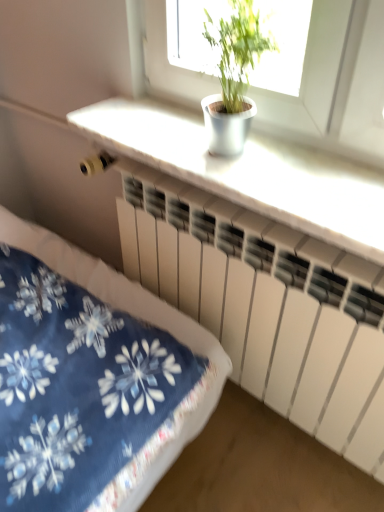
Where is `white matte radiator at center`? white matte radiator at center is located at coordinates (269, 313).

The height and width of the screenshot is (512, 384). Describe the element at coordinates (335, 84) in the screenshot. I see `green leafy plant at upper center` at that location.

Where is `white matte counter top at upper center`? white matte counter top at upper center is located at coordinates (250, 172).

Identify the location of radiator below the green leafy plant at upper center (from the image's perspective). (269, 313).

From the image's perspective, is green leafy plant at upper center located above white matte radiator at center?

Indeed, from the image's perspective, green leafy plant at upper center is shown above white matte radiator at center.

From a real-world perspective, is green leafy plant at upper center positioned above or below white matte radiator at center?

green leafy plant at upper center is above white matte radiator at center.

Based on the photo, in terms of width, does green leafy plant at upper center look wider or thinner when compared to white matte radiator at center?

green leafy plant at upper center is wider than white matte radiator at center.

What's the angular difference between white matte counter top at upper center and green leafy plant at upper center's facing directions?

0.136 degrees separate the facing orientations of white matte counter top at upper center and green leafy plant at upper center.

Is point (277, 191) closer to viewer compared to point (158, 83)?

Yes, it is in front of point (158, 83).

Does white matte counter top at upper center have a smaller size compared to green leafy plant at upper center?

No.

Does white matte counter top at upper center have a greater width compared to green leafy plant at upper center?

Yes, white matte counter top at upper center is wider than green leafy plant at upper center.

Is green leafy plant at upper center facing towards white matte counter top at upper center?

No.

Considering the sizes of objects green leafy plant at upper center and white matte counter top at upper center in the image provided, who is thinner, green leafy plant at upper center or white matte counter top at upper center?

green leafy plant at upper center.

From the picture: Is green leafy plant at upper center taller than white matte counter top at upper center?

Yes.

Between point (310, 72) and point (198, 153), which one is positioned behind?

Point (198, 153)

Considering the positions of objects white matte counter top at upper center and white matte radiator at center in the image provided, who is more to the right, white matte counter top at upper center or white matte radiator at center?

white matte radiator at center is more to the right.

Is white matte counter top at upper center positioned beyond the bounds of white matte radiator at center?

Yes, white matte counter top at upper center is outside of white matte radiator at center.

Is the surface of white matte counter top at upper center in direct contact with white matte radiator at center?

No, white matte counter top at upper center is not making contact with white matte radiator at center.

Considering the sizes of white matte counter top at upper center and white matte radiator at center in the image, is white matte counter top at upper center wider or thinner than white matte radiator at center?

Clearly, white matte counter top at upper center has more width compared to white matte radiator at center.

How distant is white matte radiator at center from green leafy plant at upper center?

white matte radiator at center is 39.75 centimeters away from green leafy plant at upper center.

Is white matte radiator at center facing away from green leafy plant at upper center?

white matte radiator at center is not turned away from green leafy plant at upper center.

Considering the sizes of objects white matte radiator at center and green leafy plant at upper center in the image provided, who is shorter, white matte radiator at center or green leafy plant at upper center?

green leafy plant at upper center.

Based on the photo, does white matte radiator at center have a greater width compared to green leafy plant at upper center?

In fact, white matte radiator at center might be narrower than green leafy plant at upper center.

From the image's perspective, would you say white matte radiator at center is positioned over white matte counter top at upper center?

No, from the image's perspective, white matte radiator at center is not above white matte counter top at upper center.

How different are the orientations of white matte radiator at center and white matte counter top at upper center in degrees?

There is a 0.681-degree angle between the facing directions of white matte radiator at center and white matte counter top at upper center.

Is white matte radiator at center surrounding white matte counter top at upper center?

No, white matte counter top at upper center is not a part of white matte radiator at center.

Where is `radiator lying behind the white matte counter top at upper center`? radiator lying behind the white matte counter top at upper center is located at coordinates (269, 313).

Find the location of a particular element. window located in front of the white matte radiator at center is located at coordinates (335, 84).

Where is `counter top that appears below the green leafy plant at upper center (from a real-world perspective)`? The width and height of the screenshot is (384, 512). counter top that appears below the green leafy plant at upper center (from a real-world perspective) is located at coordinates (250, 172).

Which object lies nearer to the anchor point white matte counter top at upper center, green leafy plant at upper center or white matte radiator at center?

The object closer to white matte counter top at upper center is green leafy plant at upper center.

Based on the photo, looking at the image, which one is located further to white matte radiator at center, green leafy plant at upper center or white matte counter top at upper center?

green leafy plant at upper center lies further to white matte radiator at center than the other object.

Estimate the real-world distances between objects in this image. Which object is closer to green leafy plant at upper center, white matte radiator at center or white matte counter top at upper center?

Among the two, white matte counter top at upper center is located nearer to green leafy plant at upper center.

From the image, which object appears to be nearer to white matte radiator at center, white matte counter top at upper center or green leafy plant at upper center?

white matte counter top at upper center is positioned closer to the anchor white matte radiator at center.

Estimate the real-world distances between objects in this image. Which object is closer to white matte counter top at upper center, white matte radiator at center or green leafy plant at upper center?

green leafy plant at upper center.

Consider the image. Estimate the real-world distances between objects in this image. Which object is closer to green leafy plant at upper center, white matte counter top at upper center or white matte radiator at center?

white matte counter top at upper center is closer to green leafy plant at upper center.

The height and width of the screenshot is (512, 384). I want to click on counter top between green leafy plant at upper center and white matte radiator at center in the vertical direction, so click(250, 172).